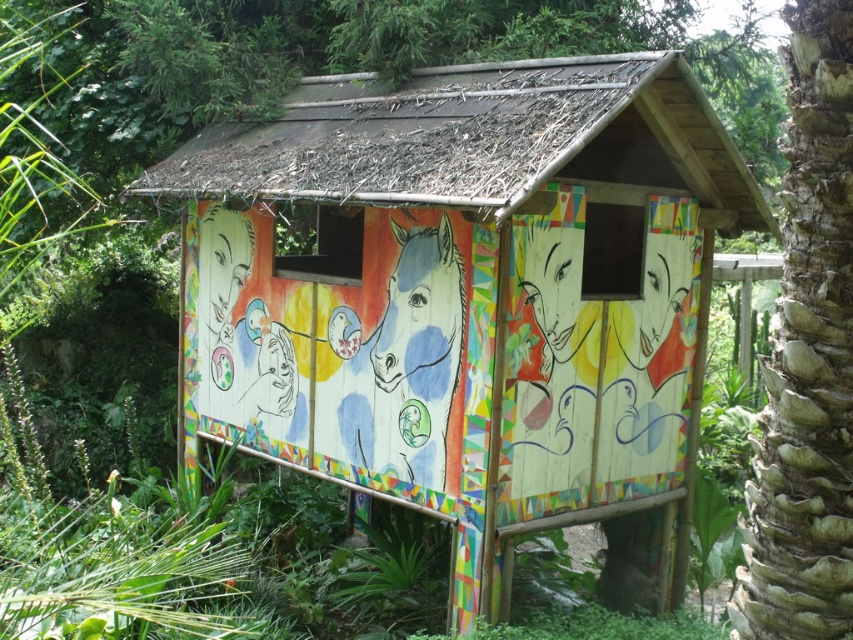
You are planning to build a fence around the wooden hut at center and the brown textured palm tree at right. If the fence needs to be at least 2 meters away from each structure, which structure requires a larger area for its fence?

The wooden hut at center requires a larger area for its fence because its width is larger than the brown textured palm tree at right, so the fence around it needs to be bigger to maintain the 2 meters distance.

You are standing in front of the wooden hut at center and want to see the brown textured palm tree at right. Which direction should you move to get a better view of the palm tree?

The wooden hut at center is above the brown textured palm tree at right, so you should move downward to get a better view of the palm tree.

You are standing in front of the wooden structure with the colorful artwork. There is a specific point at coordinates (467, 296) that you need to locate. Based on the scene description, where is this point located?

The point at coordinates (467, 296) corresponds to the wooden hut at center, so it is located at the center of the structure.